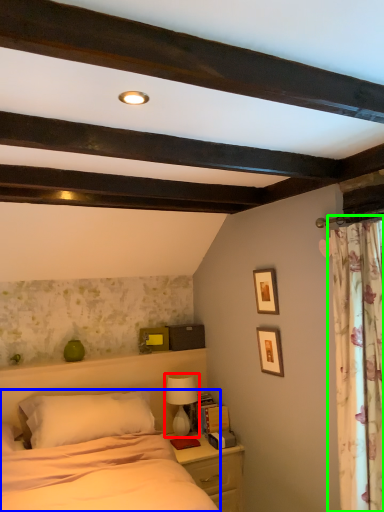
Question: Which is farther away from table lamp (highlighted by a red box)? bed (highlighted by a blue box) or curtain (highlighted by a green box)?

Choices:
 (A) bed
 (B) curtain

Answer: (B)